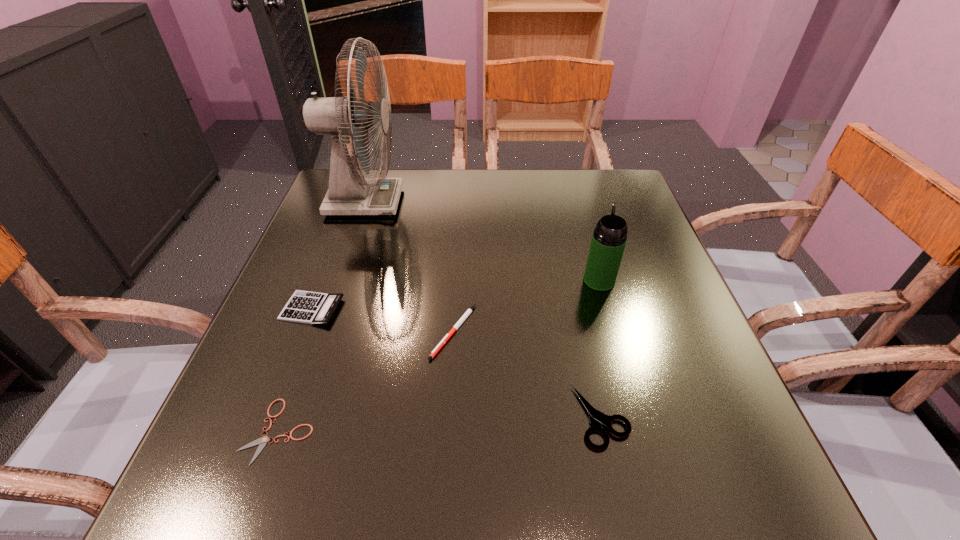
The width and height of the screenshot is (960, 540). In order to click on unoccupied position between the right shears and the farthest object in this screenshot , I will do pos(483,309).

Locate an element on the screen. unoccupied position between the pen and the thermos bottle is located at coordinates (526, 306).

I want to click on free space between the left shears and the fourth shortest object, so click(x=296, y=370).

Where is `free spot between the taller shears and the left shears`? The height and width of the screenshot is (540, 960). free spot between the taller shears and the left shears is located at coordinates (440, 424).

At what (x,y) coordinates should I click in order to perform the action: click on vacant space in between the pen and the fifth shortest object. Please return your answer as a coordinate pair (x, y). Looking at the image, I should click on (526, 306).

I want to click on vacant area between the right shears and the fan, so click(x=483, y=309).

Locate an element on the screen. This screenshot has width=960, height=540. free space between the third tallest object and the taller shears is located at coordinates (457, 363).

You are a GUI agent. You are given a task and a screenshot of the screen. Output one action in this format:
    pyautogui.click(x=<x>, y=<y>)
    Task: Click on the free space between the fourth shortest object and the fan
    Image resolution: width=960 pixels, height=540 pixels.
    Given the screenshot: What is the action you would take?
    pyautogui.click(x=339, y=255)

Locate which object ranks second in proximity to the shorter shears. Please provide its 2D coordinates. Your answer should be formatted as a tuple, i.e. [(x, y)], where the tuple contains the x and y coordinates of a point satisfying the conditions above.

[(469, 311)]

Identify which object is located as the third nearest to the right shears. Please provide its 2D coordinates. Your answer should be formatted as a tuple, i.e. [(x, y)], where the tuple contains the x and y coordinates of a point satisfying the conditions above.

[(262, 441)]